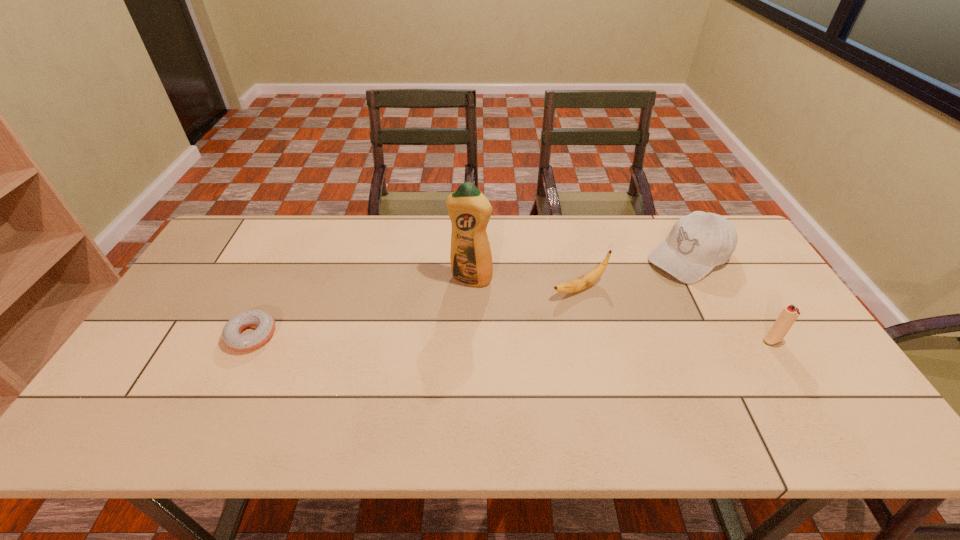
Choose which object is the second nearest neighbor to the leftmost object. Please provide its 2D coordinates. Your answer should be formatted as a tuple, i.e. [(x, y)], where the tuple contains the x and y coordinates of a point satisfying the conditions above.

[(588, 279)]

You are a GUI agent. You are given a task and a screenshot of the screen. Output one action in this format:
    pyautogui.click(x=<x>, y=<y>)
    Task: Click on the free space in the image that satisfies the following two spatial constraints: 1. on the back side of the leftmost object; 2. on the right side of the baseball cap
    The image size is (960, 540).
    Given the screenshot: What is the action you would take?
    (x=290, y=258)

Locate an element on the screen. Image resolution: width=960 pixels, height=540 pixels. free spot that satisfies the following two spatial constraints: 1. on the front side of the tallest object; 2. on the left side of the igniter is located at coordinates point(469,341).

This screenshot has width=960, height=540. What are the coordinates of `vacant area that satisfies the following two spatial constraints: 1. on the back side of the tallest object; 2. on the right side of the leftmost object` in the screenshot? It's located at (279, 279).